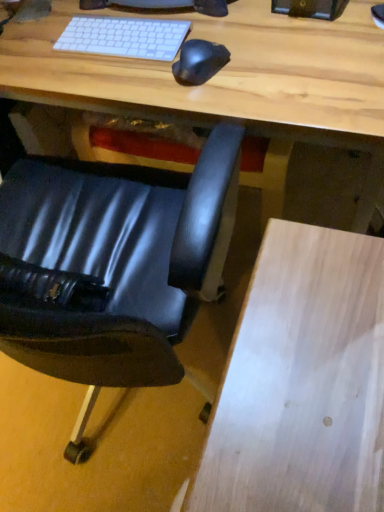
Identify the location of black rubber mouse at center. (199, 62).

From a real-world perspective, between black leather chair at lower left and black rubber mouse at center, who is vertically lower?

black leather chair at lower left.

Between black leather chair at lower left and black rubber mouse at center, which one has less height?

With less height is black rubber mouse at center.

Is black leather chair at lower left spatially inside black rubber mouse at center, or outside of it?

The correct answer is: outside.

Between black rubber mouse at center and black leather chair at lower left, which one has larger width?

black leather chair at lower left is wider.

Considering the sizes of black rubber mouse at center and black leather chair at lower left in the image, is black rubber mouse at center bigger or smaller than black leather chair at lower left?

black rubber mouse at center is smaller than black leather chair at lower left.

Is black rubber mouse at center turned away from black leather chair at lower left?

No.

Which of these two, black leather chair at lower left or light wood desk at center, is smaller?

black leather chair at lower left is smaller.

In the image, is black leather chair at lower left positioned in front of or behind light wood desk at center?

In the image, black leather chair at lower left appears in front of light wood desk at center.

From the image's perspective, is black leather chair at lower left above or below light wood desk at center?

Clearly, from the image's perspective, black leather chair at lower left is below light wood desk at center.

Is light wood desk at center positioned far away from black leather chair at lower left?

No, light wood desk at center is not far from black leather chair at lower left.

Looking at this image, between light wood desk at center and black leather chair at lower left, which one has less height?

Standing shorter between the two is light wood desk at center.

Is light wood desk at center wider than black leather chair at lower left?

Yes, light wood desk at center is wider than black leather chair at lower left.

Which object is positioned more to the left, light wood desk at center or black leather chair at lower left?

From the viewer's perspective, black leather chair at lower left appears more on the left side.

In the scene shown: From a real-world perspective, which is physically above, black rubber mouse at center or light wood desk at center?

black rubber mouse at center is physically above.

From their relative heights in the image, would you say black rubber mouse at center is taller or shorter than light wood desk at center?

In the image, black rubber mouse at center appears to be shorter than light wood desk at center.

Which point is more distant from viewer, (204, 69) or (360, 75)?

The point (204, 69) is more distant.

Measure the distance from black rubber mouse at center to light wood desk at center.

black rubber mouse at center and light wood desk at center are 7.37 inches apart from each other.

Does light wood desk at center have a greater width compared to black rubber mouse at center?

Yes, light wood desk at center is wider than black rubber mouse at center.

Is light wood desk at center positioned behind black rubber mouse at center?

That is False.

Are light wood desk at center and black rubber mouse at center located far from each other?

No, light wood desk at center is not far from black rubber mouse at center.

I want to click on mouse on the left of light wood desk at center, so click(x=199, y=62).

I want to click on mouse lying on the right of black leather chair at lower left, so click(x=199, y=62).

At what (x,y) coordinates should I click in order to perform the action: click on mouse that appears above the black leather chair at lower left (from the image's perspective). Please return your answer as a coordinate pair (x, y). The width and height of the screenshot is (384, 512). Looking at the image, I should click on (199, 62).

Which object lies nearer to the anchor point black leather chair at lower left, black rubber mouse at center or light wood desk at center?

light wood desk at center lies closer to black leather chair at lower left than the other object.

Considering their positions, is black leather chair at lower left positioned further to light wood desk at center than black rubber mouse at center?

Based on the image, black leather chair at lower left appears to be further to light wood desk at center.

From the image, which object appears to be nearer to light wood desk at center, black rubber mouse at center or black leather chair at lower left?

Among the two, black rubber mouse at center is located nearer to light wood desk at center.

Looking at the image, which one is located closer to black rubber mouse at center, light wood desk at center or black leather chair at lower left?

light wood desk at center.

When comparing their distances from black leather chair at lower left, does light wood desk at center or black rubber mouse at center seem closer?

Based on the image, light wood desk at center appears to be nearer to black leather chair at lower left.

Looking at the image, which one is located further to black rubber mouse at center, black leather chair at lower left or light wood desk at center?

Among the two, black leather chair at lower left is located further to black rubber mouse at center.

Where is `desk located between black leather chair at lower left and black rubber mouse at center in the depth direction`? desk located between black leather chair at lower left and black rubber mouse at center in the depth direction is located at coordinates (227, 78).